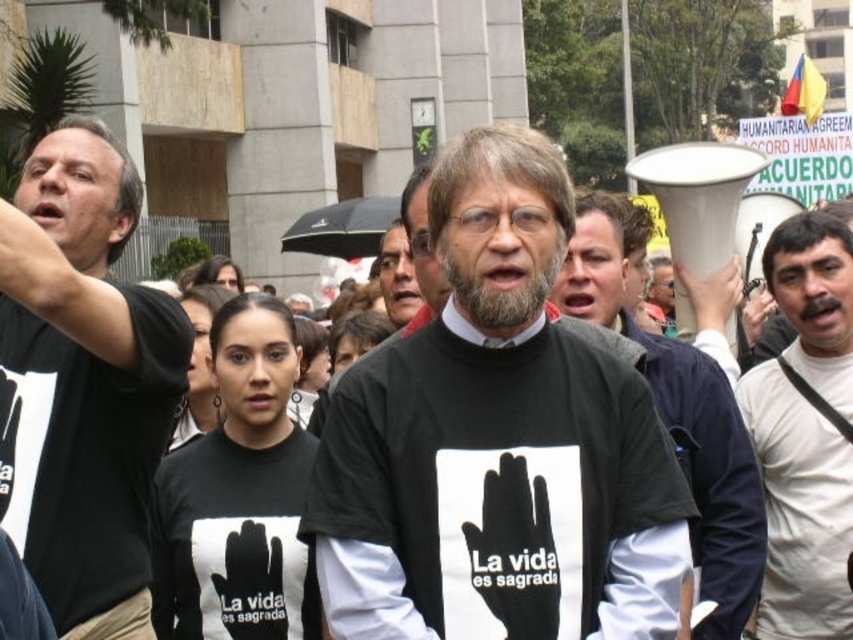
Question: Observing the image, what is the correct spatial positioning of black matte t-shirt at left in reference to black matte megaphone at center?

Choices:
 (A) above
 (B) below

Answer: (A)

Question: Which point is farther from the camera taking this photo?

Choices:
 (A) (575, 600)
 (B) (90, 433)
 (C) (724, 372)

Answer: (C)

Question: Among these points, which one is nearest to the camera?

Choices:
 (A) (62, 618)
 (B) (793, 444)

Answer: (A)

Question: Is black matte t-shirt at left wider than black matte megaphone at center?

Choices:
 (A) no
 (B) yes

Answer: (A)

Question: Which point appears farthest from the camera in this image?

Choices:
 (A) (122, 221)
 (B) (798, 529)
 (C) (363, 458)
 (D) (751, 604)

Answer: (B)

Question: Does black matte t-shirt at left appear under black matte megaphone at center?

Choices:
 (A) yes
 (B) no

Answer: (B)